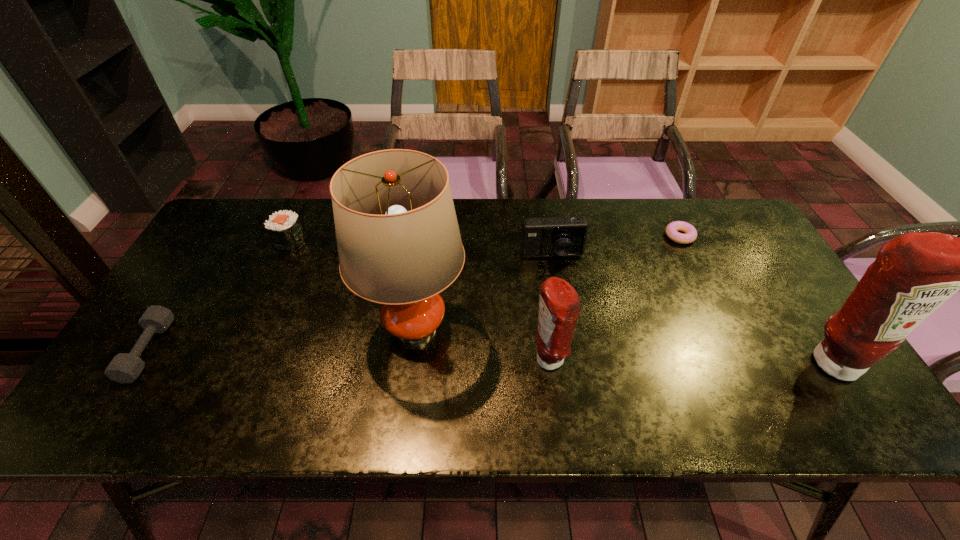
You are a GUI agent. You are given a task and a screenshot of the screen. Output one action in this format:
    pyautogui.click(x=<x>, y=<y>)
    Task: Click on the camera that is at the far edge
    
    Given the screenshot: What is the action you would take?
    pyautogui.click(x=552, y=236)

Where is `sushi present at the far edge`? sushi present at the far edge is located at coordinates (284, 228).

Where is `doughnut positioned at the far edge`? The height and width of the screenshot is (540, 960). doughnut positioned at the far edge is located at coordinates (672, 228).

The width and height of the screenshot is (960, 540). Find the location of `lamp at the near edge`. lamp at the near edge is located at coordinates (398, 240).

This screenshot has height=540, width=960. I want to click on dumbbell situated at the near edge, so (x=125, y=367).

At what (x,y) coordinates should I click in order to perform the action: click on object present at the left edge. Please return your answer as a coordinate pair (x, y). Looking at the image, I should click on (125, 367).

Find the location of a particular element. The width and height of the screenshot is (960, 540). object at the right edge is located at coordinates (915, 273).

Locate an element on the screen. Image resolution: width=960 pixels, height=540 pixels. object at the near left corner is located at coordinates (125, 367).

This screenshot has width=960, height=540. Identify the location of object located at the near right corner. (915, 273).

The height and width of the screenshot is (540, 960). Find the location of `free point at the far edge`. free point at the far edge is located at coordinates (313, 234).